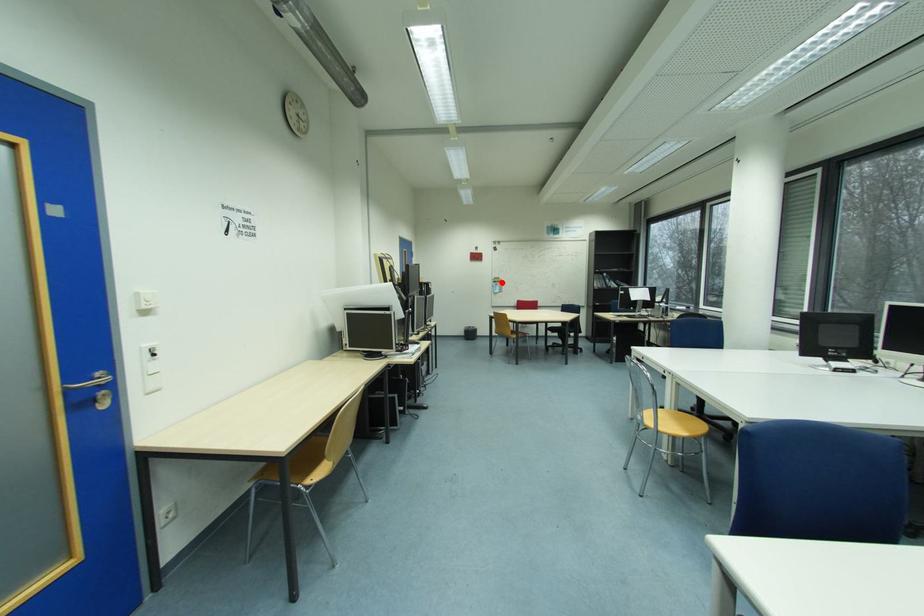
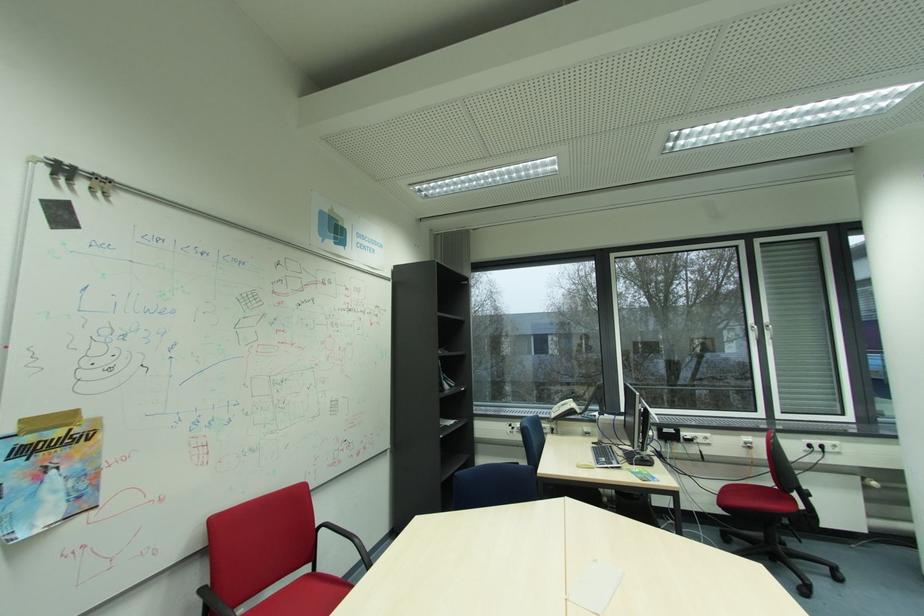
In the second image, find the point that corresponds to the highlighted location in the first image.

(31, 452)